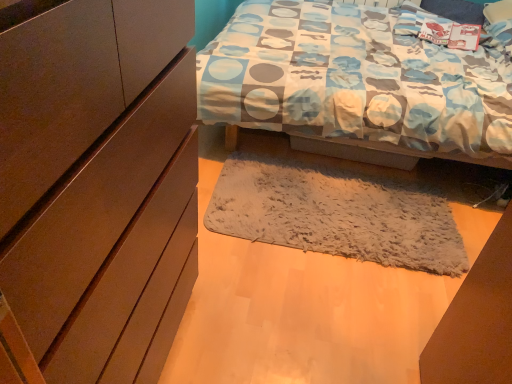
Question: Considering the relative sizes of fuzzy gray mat at center and matte brown cabinet at left in the image provided, is fuzzy gray mat at center wider than matte brown cabinet at left?

Choices:
 (A) no
 (B) yes

Answer: (B)

Question: Does fuzzy gray mat at center have a lesser width compared to matte brown cabinet at left?

Choices:
 (A) no
 (B) yes

Answer: (A)

Question: Would you consider fuzzy gray mat at center to be distant from matte brown cabinet at left?

Choices:
 (A) yes
 (B) no

Answer: (A)

Question: Is fuzzy gray mat at center not within matte brown cabinet at left?

Choices:
 (A) yes
 (B) no

Answer: (A)

Question: From a real-world perspective, does fuzzy gray mat at center sit lower than matte brown cabinet at left?

Choices:
 (A) no
 (B) yes

Answer: (B)

Question: Is fuzzy gray mat at center to the right of matte brown cabinet at left from the viewer's perspective?

Choices:
 (A) yes
 (B) no

Answer: (A)

Question: Is matte brown cabinet at left located outside fuzzy gray mat at center?

Choices:
 (A) no
 (B) yes

Answer: (B)

Question: Would you consider matte brown cabinet at left to be distant from fuzzy gray mat at center?

Choices:
 (A) no
 (B) yes

Answer: (B)

Question: Is matte brown cabinet at left surrounding fuzzy gray mat at center?

Choices:
 (A) no
 (B) yes

Answer: (A)

Question: Considering the relative sizes of matte brown cabinet at left and fuzzy gray mat at center in the image provided, is matte brown cabinet at left bigger than fuzzy gray mat at center?

Choices:
 (A) no
 (B) yes

Answer: (B)

Question: Is matte brown cabinet at left at the left side of fuzzy gray mat at center?

Choices:
 (A) no
 (B) yes

Answer: (B)

Question: Can you confirm if matte brown cabinet at left is thinner than fuzzy gray mat at center?

Choices:
 (A) yes
 (B) no

Answer: (A)

Question: Relative to fuzzy gray mat at center, is matte brown cabinet at left in front or behind?

Choices:
 (A) behind
 (B) front

Answer: (B)